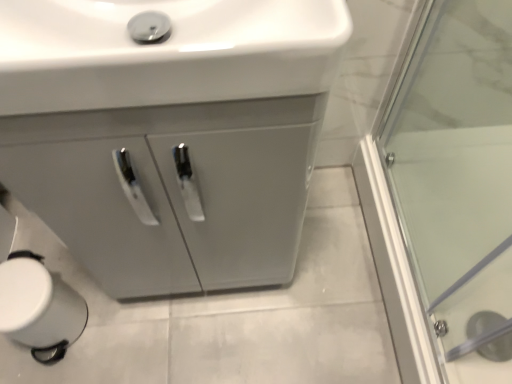
This screenshot has height=384, width=512. Identify the location of free location in front of matte gray cabinet at center. (203, 342).